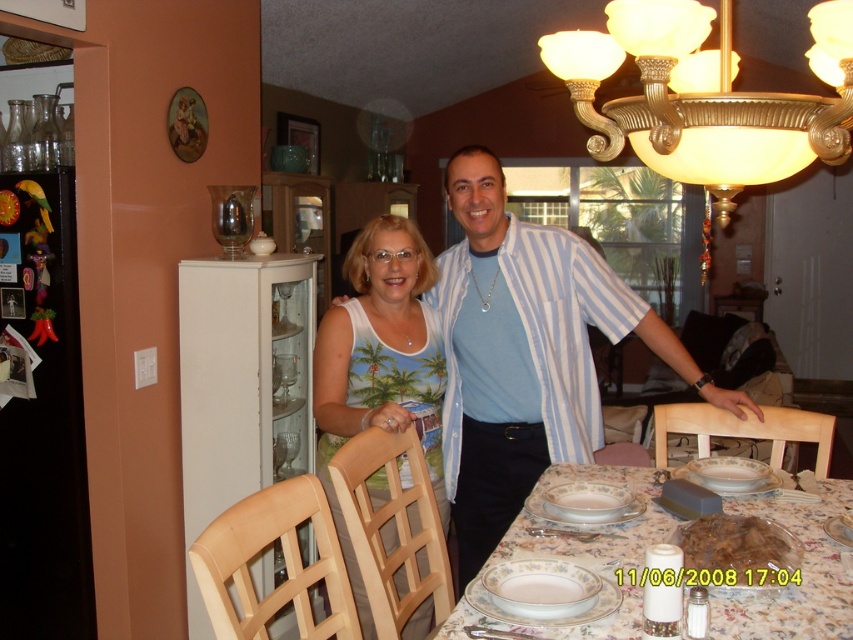
Question: Can you confirm if matte blue shirt at center is smaller than porcelain tableware at center?

Choices:
 (A) no
 (B) yes

Answer: (A)

Question: Can you confirm if porcelain tableware at center is smaller than brown matte meat at center?

Choices:
 (A) yes
 (B) no

Answer: (B)

Question: Which point is farther to the camera?

Choices:
 (A) (585, 300)
 (B) (767, 550)
 (C) (701, 164)

Answer: (A)

Question: Does matte blue shirt at center appear on the left side of white printed tank top at center?

Choices:
 (A) no
 (B) yes

Answer: (A)

Question: Among these objects, which one is nearest to the camera?

Choices:
 (A) matte blue shirt at center
 (B) white printed tank top at center

Answer: (B)

Question: Which of these objects is positioned closest to the porcelain tableware at center?

Choices:
 (A) brown matte meat at center
 (B) gold metallic chandelier at upper center
 (C) matte blue shirt at center

Answer: (A)